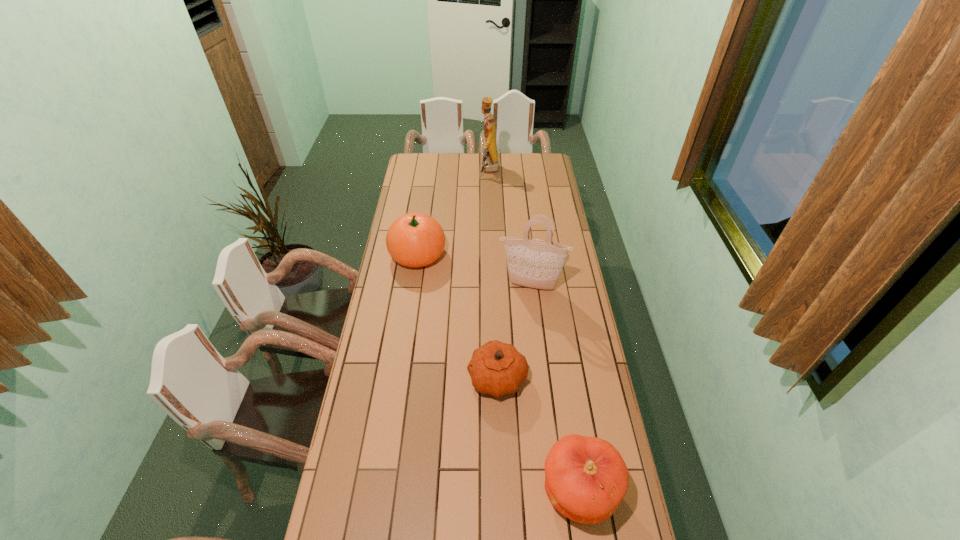
This screenshot has width=960, height=540. I want to click on nutcracker, so click(x=490, y=163).

The height and width of the screenshot is (540, 960). What are the coordinates of `shopping bag` in the screenshot? It's located at (533, 263).

This screenshot has height=540, width=960. Identify the location of the leftmost object. (415, 239).

The width and height of the screenshot is (960, 540). Find the location of `the leftmost pumpkin`. the leftmost pumpkin is located at coordinates (415, 239).

Find the location of `the nearest object`. the nearest object is located at coordinates (586, 478).

This screenshot has height=540, width=960. Identify the location of the rightmost pumpkin. (586, 478).

This screenshot has height=540, width=960. I want to click on the shortest object, so click(496, 368).

The image size is (960, 540). I want to click on the second nearest object, so click(x=496, y=368).

At what (x,y) coordinates should I click in order to perform the action: click on vacant space located 0.270m on the front-facing side of the nutcracker. Please return your answer as a coordinate pair (x, y). This screenshot has width=960, height=540. Looking at the image, I should click on (433, 171).

You are a GUI agent. You are given a task and a screenshot of the screen. Output one action in this format:
    pyautogui.click(x=<x>, y=<y>)
    Task: Click on the free space located 0.090m on the front-facing side of the nutcracker
    
    Given the screenshot: What is the action you would take?
    pyautogui.click(x=464, y=171)